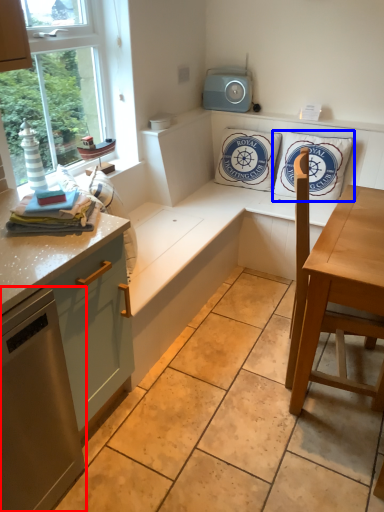
Question: Which point is closer to the camera, appliance (highlighted by a red box) or pillow (highlighted by a blue box)?

Choices:
 (A) appliance
 (B) pillow

Answer: (A)